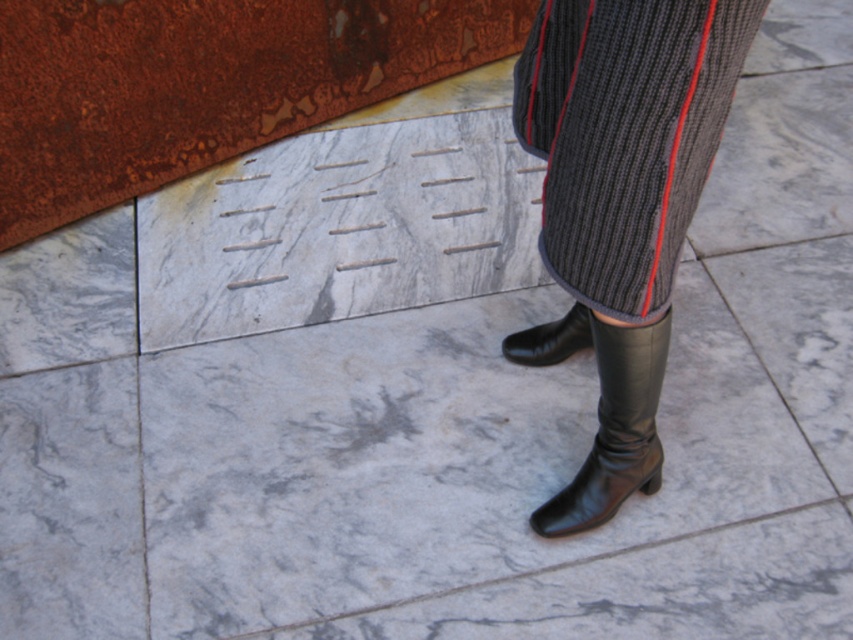
Question: Which object is the farthest from the black leather boot at lower center?

Choices:
 (A) black leather boot at lower right
 (B) ribbed wool pants at center

Answer: (B)

Question: Is black leather boot at lower right below black leather boot at lower center?

Choices:
 (A) yes
 (B) no

Answer: (A)

Question: Which point is closer to the camera taking this photo?

Choices:
 (A) (575, 332)
 (B) (566, 212)

Answer: (B)

Question: Is ribbed wool pants at center smaller than black leather boot at lower center?

Choices:
 (A) yes
 (B) no

Answer: (B)

Question: Which is nearer to the black leather boot at lower center?

Choices:
 (A) ribbed wool pants at center
 (B) black leather boot at lower right

Answer: (B)

Question: Does ribbed wool pants at center appear over black leather boot at lower center?

Choices:
 (A) yes
 (B) no

Answer: (A)